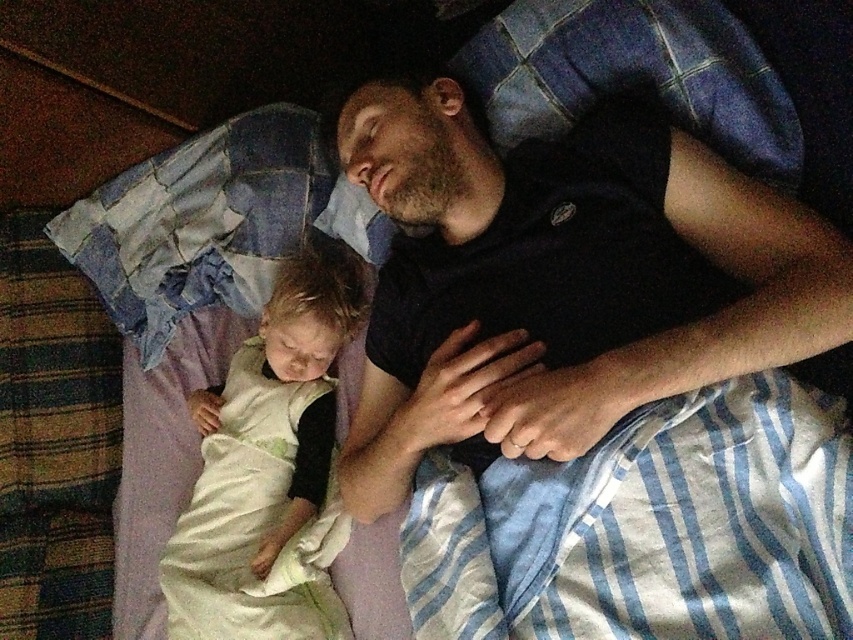
You are a photographer trying to capture the scene without disturbing them. You need to place a small camera on either the black matte shirt at upper right or the soft white blanket at lower left. Which surface is closer to you so you can reach it easily?

The black matte shirt at upper right is in front of the soft white blanket at lower left, so it is closer to you and easier to reach.

In the scene shown: You are standing in front of the bed and want to place a small nightlight. The nightlight needs to be placed closer to you. Which point should you choose between point (846, 317) and point (241, 595)?

Point (846, 317) is closer to the camera than point (241, 595), so you should choose point (846, 317) to place the nightlight closer to you.

You are a photographer who wants to capture the scene without moving any objects. You need to ensure that both the black matte shirt at upper right and the soft white blanket at lower left are clearly visible in the photo. Given their sizes, which object might require you to adjust your camera angle to include it fully in the frame?

The black matte shirt at upper right is larger in size than the soft white blanket at lower left, so it might require adjusting the camera angle to ensure it is fully visible in the photo.